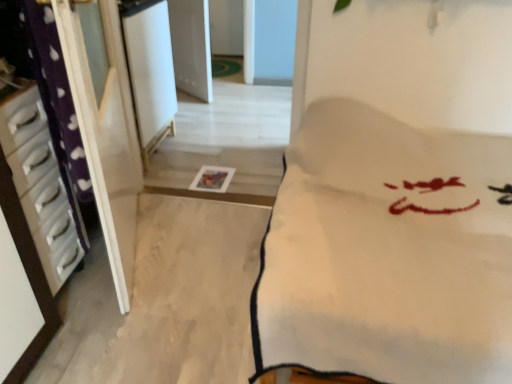
Question: Can you confirm if white glossy screen door at upper center is bigger than white glossy drawer at left, marked as the first furniture in a left-to-right arrangement?

Choices:
 (A) no
 (B) yes

Answer: (B)

Question: Is the depth of white glossy screen door at upper center greater than that of white glossy drawer at left, marked as the first furniture in a left-to-right arrangement?

Choices:
 (A) yes
 (B) no

Answer: (A)

Question: Is white glossy screen door at upper center facing towards white glossy drawer at left, marked as the first furniture in a left-to-right arrangement?

Choices:
 (A) no
 (B) yes

Answer: (A)

Question: Is white glossy screen door at upper center shorter than white glossy drawer at left, marked as the first furniture in a left-to-right arrangement?

Choices:
 (A) no
 (B) yes

Answer: (A)

Question: Considering the relative positions of white glossy screen door at upper center and white glossy drawer at left, which ranks as the 2th furniture in right-to-left order, in the image provided, is white glossy screen door at upper center to the right of white glossy drawer at left, which ranks as the 2th furniture in right-to-left order, from the viewer's perspective?

Choices:
 (A) yes
 (B) no

Answer: (A)

Question: Is white glossy drawer at left, which ranks as the 2th furniture in right-to-left order, completely or partially inside white glossy screen door at upper center?

Choices:
 (A) yes
 (B) no

Answer: (B)

Question: Considering the relative sizes of white soft blanket at center, which appears as the 2th furniture when viewed from the left, and white glossy screen door at upper center in the image provided, is white soft blanket at center, which appears as the 2th furniture when viewed from the left, shorter than white glossy screen door at upper center?

Choices:
 (A) no
 (B) yes

Answer: (A)

Question: Is white soft blanket at center, which appears as the 2th furniture when viewed from the left, at the left side of white glossy screen door at upper center?

Choices:
 (A) yes
 (B) no

Answer: (B)

Question: Is white soft blanket at center, which is the first furniture in right-to-left order, positioned beyond the bounds of white glossy screen door at upper center?

Choices:
 (A) yes
 (B) no

Answer: (A)

Question: Is the depth of white soft blanket at center, which appears as the 2th furniture when viewed from the left, less than that of white glossy screen door at upper center?

Choices:
 (A) yes
 (B) no

Answer: (A)

Question: From the image's perspective, is white soft blanket at center, which appears as the 2th furniture when viewed from the left, under white glossy screen door at upper center?

Choices:
 (A) yes
 (B) no

Answer: (A)

Question: Does white glossy drawer at left, which ranks as the 2th furniture in right-to-left order, have a larger size compared to white glossy screen door at upper center?

Choices:
 (A) no
 (B) yes

Answer: (A)